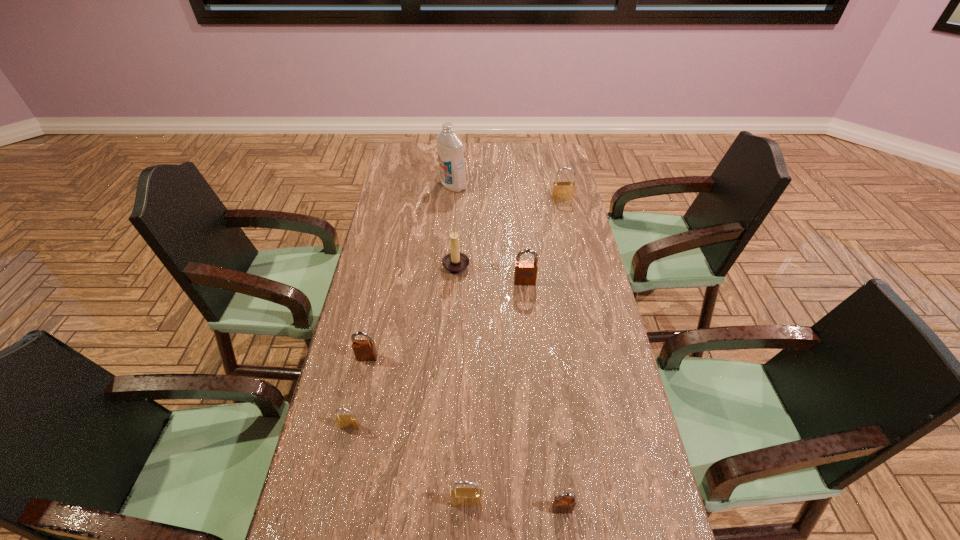
Image resolution: width=960 pixels, height=540 pixels. In order to click on the nearest brass padlock in this screenshot , I will do `click(460, 497)`.

At what (x,y) coordinates should I click in order to perform the action: click on the third padlock from left to right. Please return your answer as a coordinate pair (x, y). The image size is (960, 540). Looking at the image, I should click on (460, 497).

The width and height of the screenshot is (960, 540). In order to click on the third nearest padlock in this screenshot , I will do `click(343, 421)`.

Locate an element on the screen. This screenshot has height=540, width=960. the second nearest brass padlock is located at coordinates (343, 421).

Where is `the smallest brown padlock`? The image size is (960, 540). the smallest brown padlock is located at coordinates (564, 503).

Locate an element on the screen. The width and height of the screenshot is (960, 540). free space located 0.180m on the front of the white detergent is located at coordinates (450, 219).

This screenshot has width=960, height=540. Find the location of `vacant region located on the wick of the candle holder`. vacant region located on the wick of the candle holder is located at coordinates (494, 265).

Where is `vacant area located on the front-facing side of the biggest brass padlock`? vacant area located on the front-facing side of the biggest brass padlock is located at coordinates (565, 214).

Locate an element on the screen. This screenshot has width=960, height=540. free region located on the front-facing side of the farthest brown padlock is located at coordinates (527, 303).

The image size is (960, 540). Find the location of `vacant region located 0.080m on the front-facing side of the fourth nearest object`. vacant region located 0.080m on the front-facing side of the fourth nearest object is located at coordinates (361, 385).